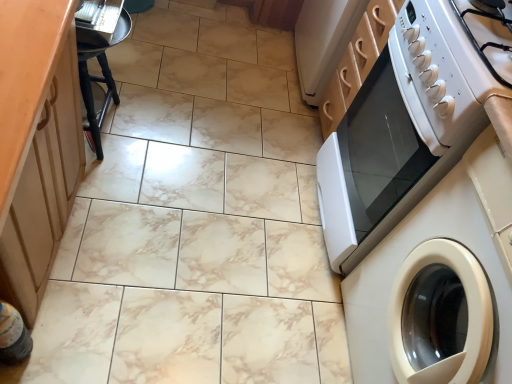
Question: Is white glossy oven at right at the back of black wood stool at left?

Choices:
 (A) no
 (B) yes

Answer: (A)

Question: Is black wood stool at left at the right side of white glossy oven at right?

Choices:
 (A) yes
 (B) no

Answer: (B)

Question: Is black wood stool at left behind white glossy oven at right?

Choices:
 (A) no
 (B) yes

Answer: (B)

Question: Is black wood stool at left wider than white glossy oven at right?

Choices:
 (A) no
 (B) yes

Answer: (A)

Question: From the image's perspective, does black wood stool at left appear higher than white glossy oven at right?

Choices:
 (A) yes
 (B) no

Answer: (A)

Question: Is translucent plastic bottle at lower left spatially inside black wood stool at left, or outside of it?

Choices:
 (A) outside
 (B) inside

Answer: (A)

Question: In terms of size, does translucent plastic bottle at lower left appear bigger or smaller than black wood stool at left?

Choices:
 (A) big
 (B) small

Answer: (B)

Question: Would you say translucent plastic bottle at lower left is to the left or to the right of black wood stool at left in the picture?

Choices:
 (A) right
 (B) left

Answer: (B)

Question: From a real-world perspective, is translucent plastic bottle at lower left above or below black wood stool at left?

Choices:
 (A) below
 (B) above

Answer: (A)

Question: In the image, is white glossy washing machine at right positioned in front of or behind black wood stool at left?

Choices:
 (A) behind
 (B) front

Answer: (B)

Question: Is point (506, 292) positioned closer to the camera than point (89, 104)?

Choices:
 (A) farther
 (B) closer

Answer: (B)

Question: From their relative heights in the image, would you say white glossy washing machine at right is taller or shorter than black wood stool at left?

Choices:
 (A) short
 (B) tall

Answer: (B)

Question: Considering the positions of white glossy washing machine at right and black wood stool at left in the image, is white glossy washing machine at right bigger or smaller than black wood stool at left?

Choices:
 (A) big
 (B) small

Answer: (A)

Question: Relative to wooden cabinet at left, is white glossy washing machine at right in front or behind?

Choices:
 (A) front
 (B) behind

Answer: (B)

Question: From the image's perspective, is white glossy washing machine at right located above or below wooden cabinet at left?

Choices:
 (A) below
 (B) above

Answer: (A)